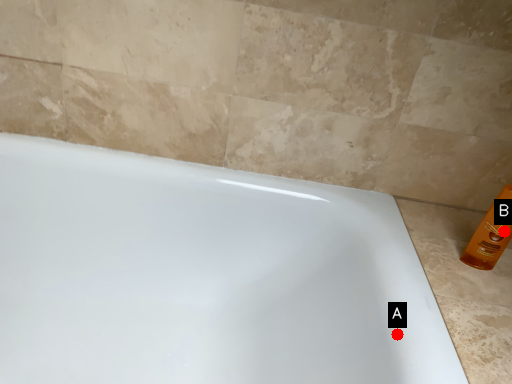
Question: Two points are circled on the image, labeled by A and B beside each circle. Among these points, which one is farthest from the camera?

Choices:
 (A) A is further
 (B) B is further

Answer: (B)